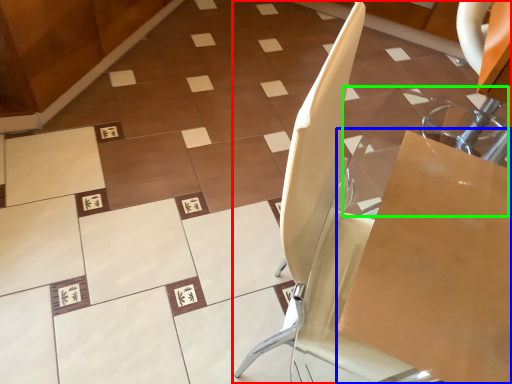
Question: Which is nearer to the furniture (highlighted by a red box)? cardboard box (highlighted by a blue box) or glass table (highlighted by a green box).

Choices:
 (A) cardboard box
 (B) glass table

Answer: (A)